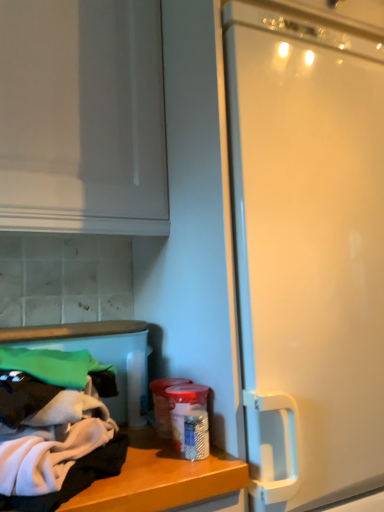
Where is `translucent plastic container at lower center`? The height and width of the screenshot is (512, 384). translucent plastic container at lower center is located at coordinates (189, 419).

Describe the element at coordinates (189, 419) in the screenshot. The image size is (384, 512). I see `translucent plastic container at lower center` at that location.

The width and height of the screenshot is (384, 512). Identify the location of white soft cloth at lower left. (52, 434).

This screenshot has width=384, height=512. What do you see at coordinates (52, 434) in the screenshot?
I see `white soft cloth at lower left` at bounding box center [52, 434].

I want to click on translucent plastic container at lower center, so click(189, 419).

Is translucent plastic container at lower center to the right of white soft cloth at lower left from the viewer's perspective?

Yes, translucent plastic container at lower center is to the right of white soft cloth at lower left.

Considering the positions of objects translucent plastic container at lower center and white soft cloth at lower left in the image provided, who is in front, translucent plastic container at lower center or white soft cloth at lower left?

white soft cloth at lower left is closer to the camera.

Is point (200, 416) positioned after point (43, 405)?

Yes.

From the image's perspective, is translucent plastic container at lower center above white soft cloth at lower left?

No, from the image's perspective, translucent plastic container at lower center is not above white soft cloth at lower left.

From a real-world perspective, who is located lower, translucent plastic container at lower center or white soft cloth at lower left?

translucent plastic container at lower center.

Can you confirm if translucent plastic container at lower center is wider than white soft cloth at lower left?

In fact, translucent plastic container at lower center might be narrower than white soft cloth at lower left.

From their relative heights in the image, would you say translucent plastic container at lower center is taller or shorter than white soft cloth at lower left?

Considering their sizes, translucent plastic container at lower center has more height than white soft cloth at lower left.

In terms of size, does translucent plastic container at lower center appear bigger or smaller than white soft cloth at lower left?

In the image, translucent plastic container at lower center appears to be smaller than white soft cloth at lower left.

Would you say translucent plastic container at lower center is inside or outside white soft cloth at lower left?

translucent plastic container at lower center exists outside the volume of white soft cloth at lower left.

Would you consider translucent plastic container at lower center to be distant from white soft cloth at lower left?

That's not correct — translucent plastic container at lower center is a little close to white soft cloth at lower left.

Is translucent plastic container at lower center looking in the opposite direction of white soft cloth at lower left?

No.

How much distance is there between translucent plastic container at lower center and white soft cloth at lower left?

20.49 centimeters.

You are a GUI agent. You are given a task and a screenshot of the screen. Output one action in this format:
    pyautogui.click(x=<x>, y=<y>)
    Task: Click on the clothing located above the translucent plastic container at lower center (from a real-world perspective)
    
    Given the screenshot: What is the action you would take?
    pyautogui.click(x=52, y=434)

Is white soft cloth at lower left at the left side of translucent plastic container at lower center?

Yes.

Is the position of white soft cloth at lower left less distant than that of translucent plastic container at lower center?

Yes, it is.

Is point (103, 461) closer to camera compared to point (171, 399)?

Yes, point (103, 461) is closer to viewer.

From the image's perspective, relative to translucent plastic container at lower center, is white soft cloth at lower left above or below?

Based on their image positions, white soft cloth at lower left is located above translucent plastic container at lower center.

From a real-world perspective, does white soft cloth at lower left stand above translucent plastic container at lower center?

Indeed, from a real-world perspective, white soft cloth at lower left stands above translucent plastic container at lower center.

Looking at their sizes, would you say white soft cloth at lower left is wider or thinner than translucent plastic container at lower center?

Considering their sizes, white soft cloth at lower left looks broader than translucent plastic container at lower center.

Can you confirm if white soft cloth at lower left is taller than translucent plastic container at lower center?

No.

Is white soft cloth at lower left bigger or smaller than translucent plastic container at lower center?

Clearly, white soft cloth at lower left is larger in size than translucent plastic container at lower center.

Would you say translucent plastic container at lower center is part of white soft cloth at lower left's contents?

No, translucent plastic container at lower center is not a part of white soft cloth at lower left.

Is white soft cloth at lower left positioned far away from translucent plastic container at lower center?

No.

Is white soft cloth at lower left looking in the opposite direction of translucent plastic container at lower center?

white soft cloth at lower left does not have its back to translucent plastic container at lower center.

What's the angular difference between white soft cloth at lower left and translucent plastic container at lower center's facing directions?

The angle between the facing direction of white soft cloth at lower left and the facing direction of translucent plastic container at lower center is 31.4 degrees.

Locate an element on the screen. This screenshot has height=512, width=384. clothing positioned vertically above the translucent plastic container at lower center (from a real-world perspective) is located at coordinates (52, 434).

I want to click on garbage behind the white soft cloth at lower left, so click(x=189, y=419).

You are a GUI agent. You are given a task and a screenshot of the screen. Output one action in this format:
    pyautogui.click(x=<x>, y=<y>)
    Task: Click on the clothing on the left of translucent plastic container at lower center
    The width and height of the screenshot is (384, 512).
    Given the screenshot: What is the action you would take?
    pyautogui.click(x=52, y=434)